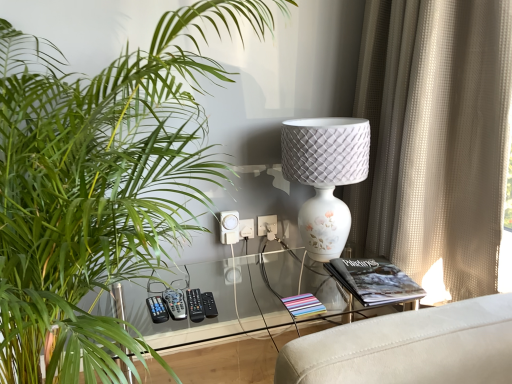
Question: Does white plastic electric outlet at center, the 1th electric outlet from the right, have a lesser height compared to green leafy plant at left?

Choices:
 (A) no
 (B) yes

Answer: (B)

Question: Is white plastic electric outlet at center, the 1th electric outlet from the right, positioned before green leafy plant at left?

Choices:
 (A) no
 (B) yes

Answer: (A)

Question: Is white plastic electric outlet at center, the 1th electric outlet from the right, surrounding green leafy plant at left?

Choices:
 (A) yes
 (B) no

Answer: (B)

Question: Is white plastic electric outlet at center, the 1th electric outlet from the right, oriented away from green leafy plant at left?

Choices:
 (A) yes
 (B) no

Answer: (B)

Question: From the image's perspective, is white plastic electric outlet at center, which is the 2th electric outlet from left to right, on top of green leafy plant at left?

Choices:
 (A) yes
 (B) no

Answer: (A)

Question: Does white plastic electric outlet at center, which is the 2th electric outlet from left to right, have a larger size compared to green leafy plant at left?

Choices:
 (A) no
 (B) yes

Answer: (A)

Question: Is white textured lamp at center surrounded by white plastic electric outlet at center, which is counted as the 1th electric outlet, starting from the left?

Choices:
 (A) yes
 (B) no

Answer: (B)

Question: Is white plastic electric outlet at center, which is counted as the 1th electric outlet, starting from the left, not inside white textured lamp at center?

Choices:
 (A) yes
 (B) no

Answer: (A)

Question: Is the surface of white plastic electric outlet at center, which is counted as the 1th electric outlet, starting from the left, in direct contact with white textured lamp at center?

Choices:
 (A) no
 (B) yes

Answer: (A)

Question: Is white plastic electric outlet at center, which is counted as the 1th electric outlet, starting from the left, turned away from white textured lamp at center?

Choices:
 (A) no
 (B) yes

Answer: (A)

Question: From the image's perspective, would you say white plastic electric outlet at center, which is the second electric outlet from right to left, is positioned over white textured lamp at center?

Choices:
 (A) yes
 (B) no

Answer: (B)

Question: Is white plastic electric outlet at center, which is counted as the 1th electric outlet, starting from the left, bigger than white textured lamp at center?

Choices:
 (A) no
 (B) yes

Answer: (A)

Question: Is green leafy plant at left smaller than gray plastic remote at lower center, the 3th control viewed from the right?

Choices:
 (A) no
 (B) yes

Answer: (A)